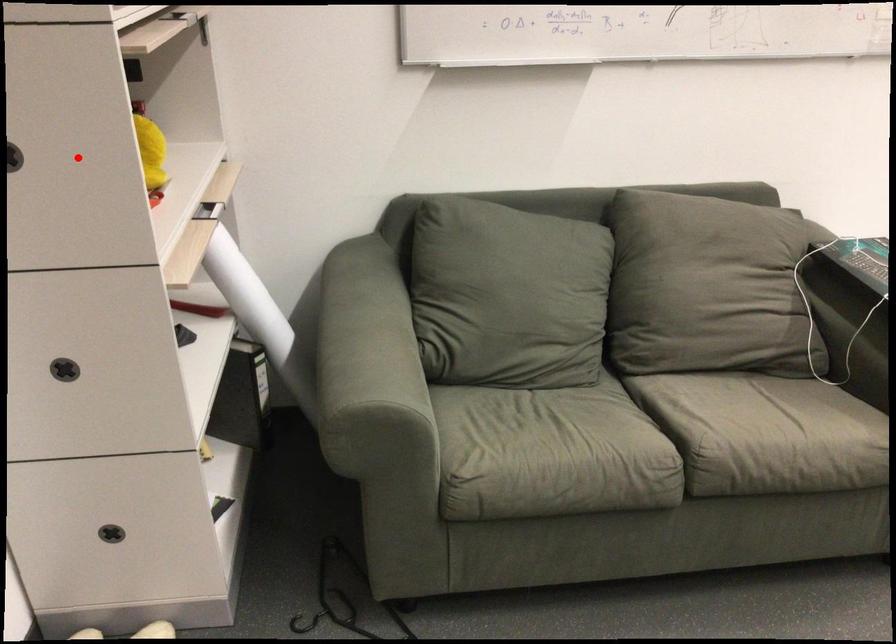
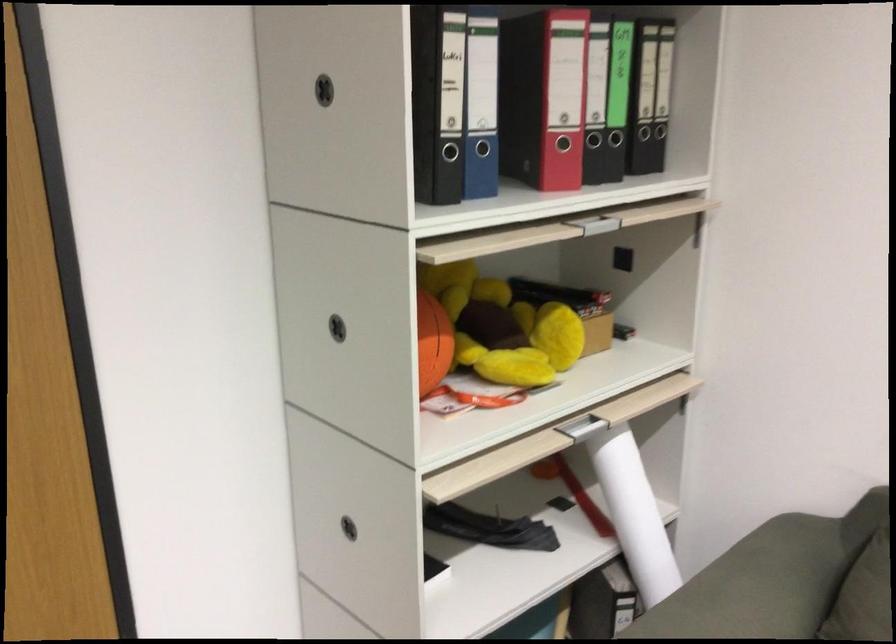
Question: I am providing you with two images of the same scene from different viewpoints. A red point is marked on the first image. At the location where the point appears in image 1, is it still visible in image 2?

Choices:
 (A) Yes
 (B) No

Answer: (A)